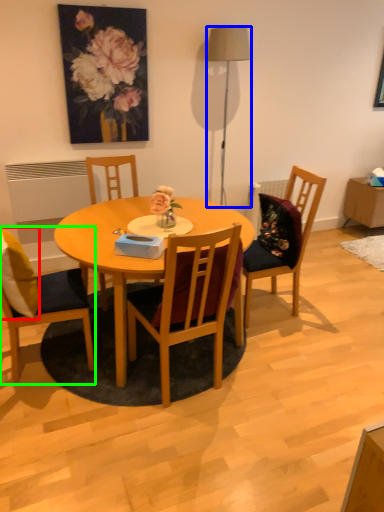
Question: Estimate the real-world distances between objects in this image. Which object is closer to pillow (highlighted by a red box), lamp (highlighted by a blue box) or chair (highlighted by a green box)?

Choices:
 (A) lamp
 (B) chair

Answer: (B)